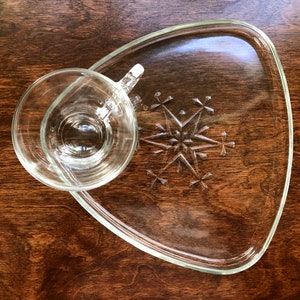
Image resolution: width=300 pixels, height=300 pixels. In order to click on rim of dish in this screenshot , I will do `click(288, 100)`.